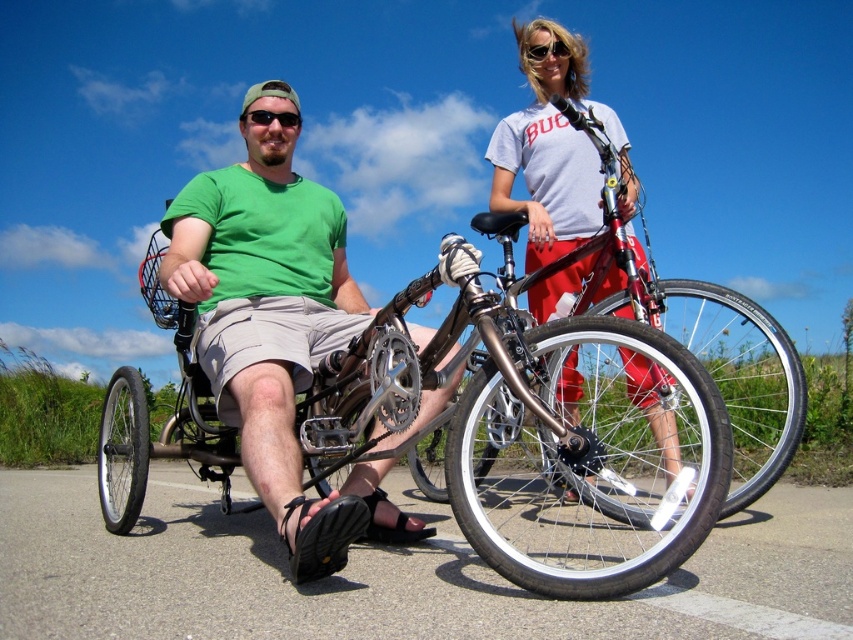
You are a photographer trying to capture a clear photo of both the green matte shirt at center and the black matte sunglasses at center. Since you want both items to be visible clearly in the photo, which object should you focus on first to ensure proper focus?

You should focus on the green matte shirt at center first because it is larger in size than the black matte sunglasses at center, making it easier to focus on the larger object first for clarity.